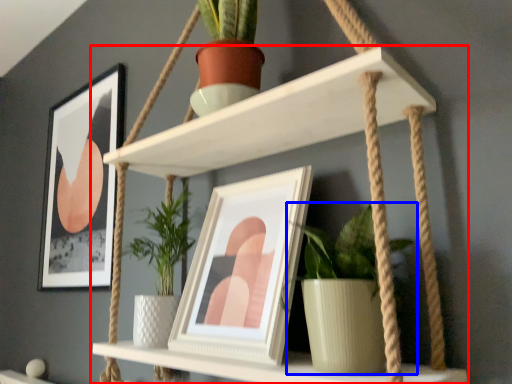
Question: Which object appears farthest to the camera in this image, shelf (highlighted by a red box) or houseplant (highlighted by a blue box)?

Choices:
 (A) shelf
 (B) houseplant

Answer: (B)